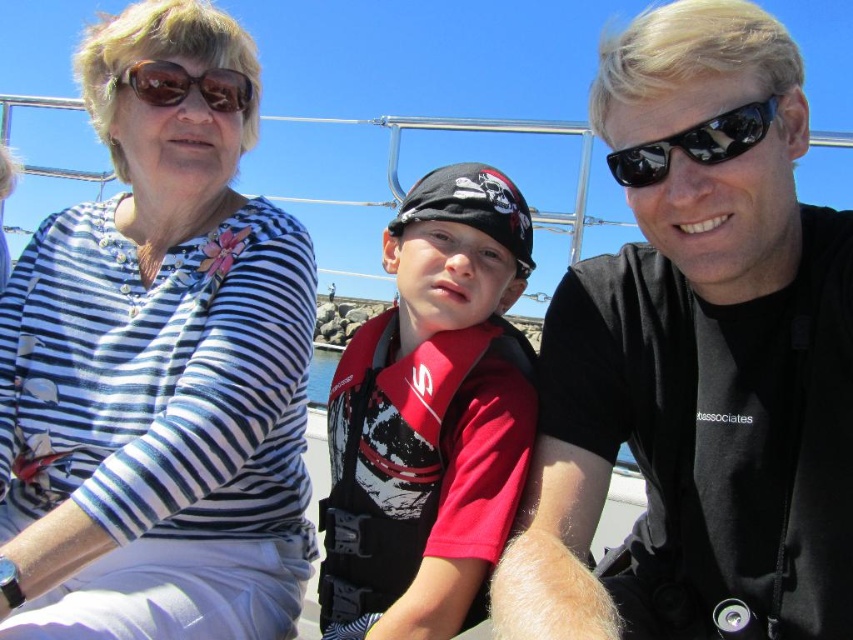
Measure the distance between red life vest at center and camera.

red life vest at center and camera are 16.90 meters apart.

Which is more to the right, red life vest at center or sunglasses at right?

sunglasses at right is more to the right.

Where is `red life vest at center`? This screenshot has width=853, height=640. red life vest at center is located at coordinates (430, 417).

Does white striped shirt at upper left appear over red life vest at center?

Indeed, white striped shirt at upper left is positioned over red life vest at center.

Can you confirm if white striped shirt at upper left is positioned below red life vest at center?

No.

Between point (71, 282) and point (463, 221), which one is positioned in front?

Point (71, 282) is in front.

Image resolution: width=853 pixels, height=640 pixels. Identify the location of white striped shirt at upper left. (158, 371).

Which is below, white striped shirt at upper left or sunglasses at right?

white striped shirt at upper left is lower down.

Is white striped shirt at upper left shorter than sunglasses at right?

In fact, white striped shirt at upper left may be taller than sunglasses at right.

What do you see at coordinates (158, 371) in the screenshot? I see `white striped shirt at upper left` at bounding box center [158, 371].

This screenshot has height=640, width=853. In order to click on white striped shirt at upper left in this screenshot , I will do pos(158,371).